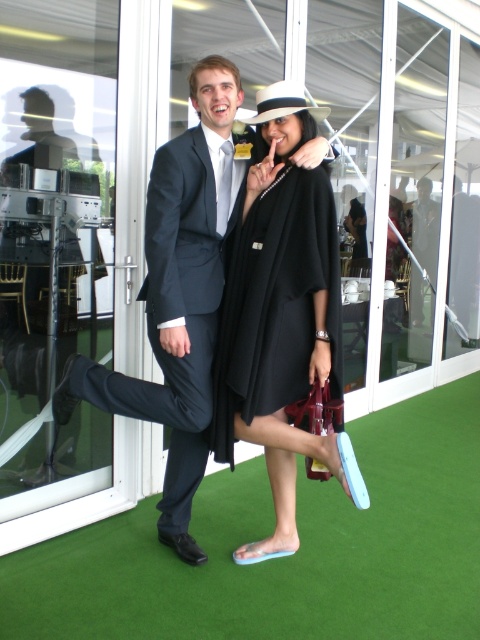
Question: In this image, where is black matte coat at center located relative to dark blue wool suit at center?

Choices:
 (A) above
 (B) below

Answer: (A)

Question: Which is nearer to the black matte dress at center?

Choices:
 (A) black matte coat at center
 (B) matte black suit at center

Answer: (A)

Question: Is matte black suit at center to the right of dark blue wool suit at center from the viewer's perspective?

Choices:
 (A) no
 (B) yes

Answer: (B)

Question: Which point is closer to the camera?

Choices:
 (A) matte black suit at center
 (B) black matte dress at center
 (C) black matte coat at center
 (D) dark blue wool suit at center

Answer: (C)

Question: Which point is closer to the camera?

Choices:
 (A) matte black suit at center
 (B) dark blue wool suit at center
 (C) black matte dress at center
 (D) black matte coat at center

Answer: (D)

Question: Does matte black suit at center come behind black matte dress at center?

Choices:
 (A) no
 (B) yes

Answer: (A)